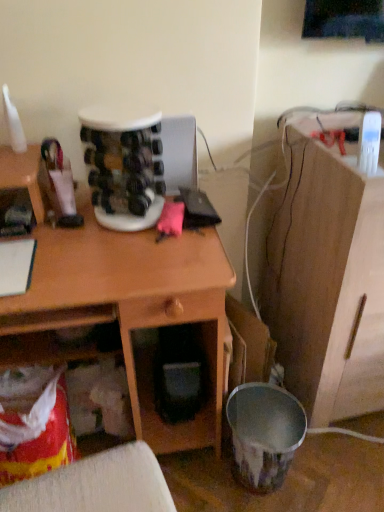
Question: From a real-world perspective, is wooden desk at center located beneath wooden cabinet at right?

Choices:
 (A) no
 (B) yes

Answer: (B)

Question: Would you consider wooden desk at center to be distant from wooden cabinet at right?

Choices:
 (A) yes
 (B) no

Answer: (B)

Question: Can you confirm if wooden desk at center is wider than wooden cabinet at right?

Choices:
 (A) no
 (B) yes

Answer: (A)

Question: Is wooden desk at center next to wooden cabinet at right and touching it?

Choices:
 (A) no
 (B) yes

Answer: (A)

Question: From the image's perspective, is wooden desk at center over wooden cabinet at right?

Choices:
 (A) no
 (B) yes

Answer: (A)

Question: Is wooden desk at center positioned beyond the bounds of wooden cabinet at right?

Choices:
 (A) yes
 (B) no

Answer: (A)

Question: Does wooden cabinet at right have a larger size compared to wooden desk at center?

Choices:
 (A) yes
 (B) no

Answer: (B)

Question: Would you say wooden cabinet at right contains wooden desk at center?

Choices:
 (A) yes
 (B) no

Answer: (B)

Question: Considering the relative sizes of wooden cabinet at right and wooden desk at center in the image provided, is wooden cabinet at right taller than wooden desk at center?

Choices:
 (A) yes
 (B) no

Answer: (A)

Question: From the image's perspective, is wooden cabinet at right beneath wooden desk at center?

Choices:
 (A) no
 (B) yes

Answer: (A)

Question: Is wooden cabinet at right shorter than wooden desk at center?

Choices:
 (A) no
 (B) yes

Answer: (A)

Question: Is wooden cabinet at right next to wooden desk at center and touching it?

Choices:
 (A) no
 (B) yes

Answer: (A)

Question: Based on their sizes in the image, would you say wooden cabinet at right is bigger or smaller than wooden desk at center?

Choices:
 (A) big
 (B) small

Answer: (B)